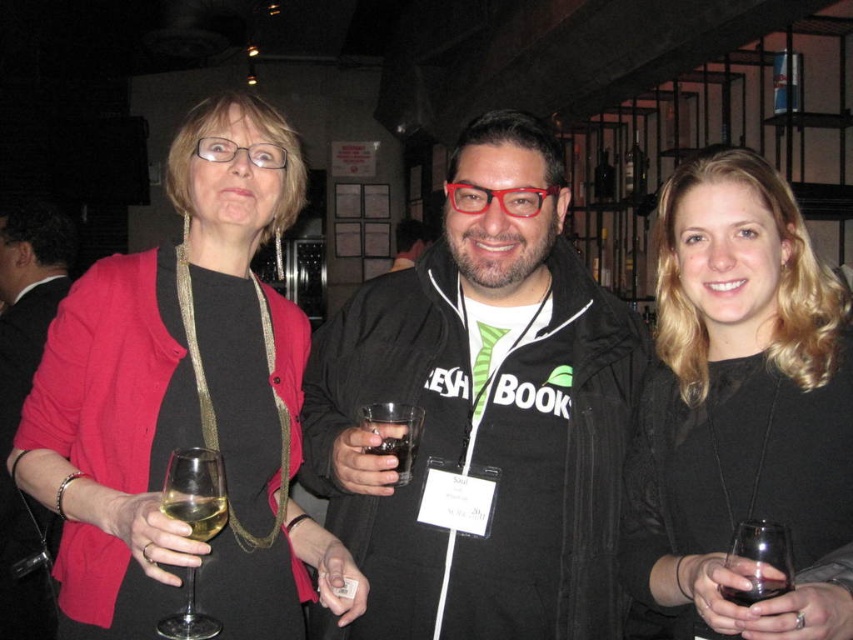
You are a photographer at a social event and need to capture a closeup shot of the black matte dress at center and the dark glass at center. Since the camera can only focus on one object at a time, which object should you choose to ensure the other remains in the background?

The black matte dress at center is bigger than the dark glass at center, so you should focus on the black matte dress at center to ensure the dark glass at center stays in the background.

What is the exact position of the black fabric jacket at center in the image?

The black fabric jacket at center is located at point (22,403).